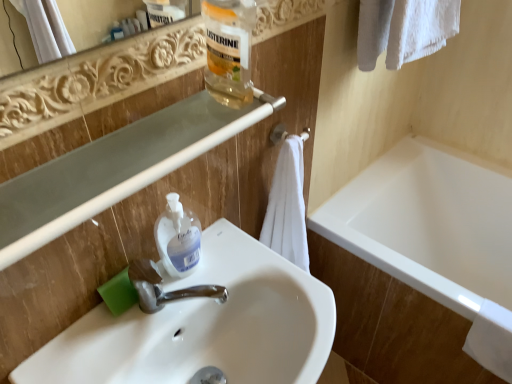
Question: Is white glossy bathtub at lower right wider or thinner than white glossy sink at center?

Choices:
 (A) wide
 (B) thin

Answer: (A)

Question: From a real-world perspective, is white glossy bathtub at lower right positioned above or below white glossy sink at center?

Choices:
 (A) below
 (B) above

Answer: (A)

Question: Which object is positioned closest to the white glossy bathtub at lower right?

Choices:
 (A) clear plastic balustrade at upper center
 (B) translucent plastic bottle at upper center
 (C) white matte towel bar at center
 (D) white soft towel at center
 (E) white glossy sink at center

Answer: (D)

Question: Considering the real-world distances, which object is farthest from the white glossy sink at center?

Choices:
 (A) translucent plastic hand soap at sink
 (B) white soft towel at center
 (C) clear plastic balustrade at upper center
 (D) white matte towel bar at center
 (E) white glossy bathtub at lower right

Answer: (E)